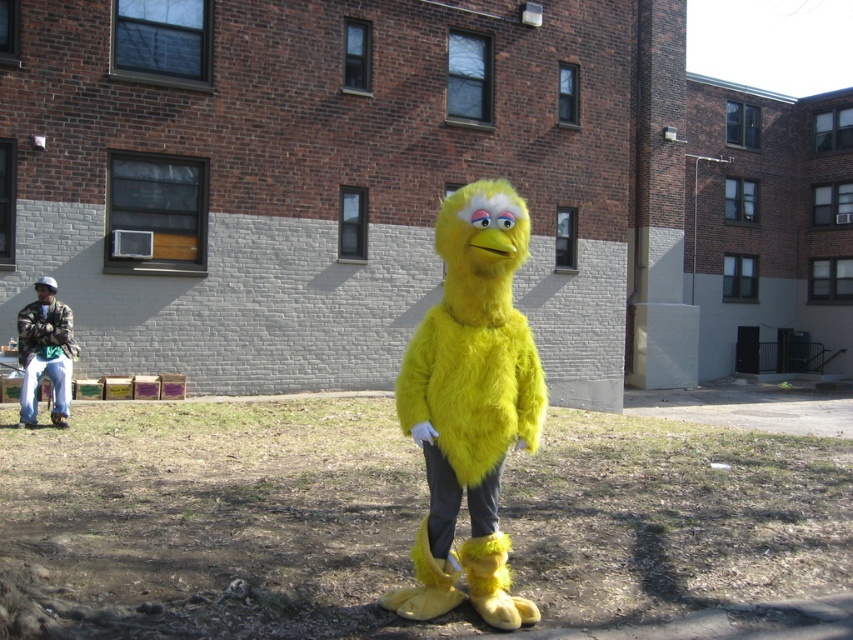
Question: Which object is closer to the camera taking this photo?

Choices:
 (A) fluffy yellow bird at center
 (B) camo fabric jacket at left

Answer: (A)

Question: Which point is closer to the camera taking this photo?

Choices:
 (A) (485, 493)
 (B) (77, 346)

Answer: (A)

Question: From the image, what is the correct spatial relationship of fluffy yellow bird at center in relation to camo fabric jacket at left?

Choices:
 (A) left
 (B) right

Answer: (B)

Question: Can you confirm if fluffy yellow bird at center is positioned above camo fabric jacket at left?

Choices:
 (A) no
 (B) yes

Answer: (A)

Question: Can you confirm if fluffy yellow bird at center is wider than camo fabric jacket at left?

Choices:
 (A) yes
 (B) no

Answer: (B)